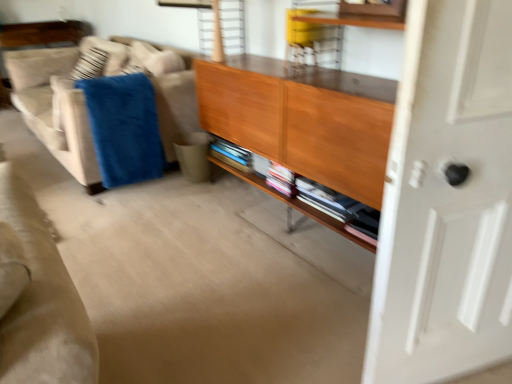
The width and height of the screenshot is (512, 384). I want to click on blue soft blanket at left, so click(124, 128).

This screenshot has height=384, width=512. What do you see at coordinates (294, 204) in the screenshot? I see `wooden shelf at center` at bounding box center [294, 204].

In the scene shown: In order to face beige fabric couch at left, should I rotate leftwards or rightwards?

To align with it, rotate left about 20.024°.

Image resolution: width=512 pixels, height=384 pixels. What do you see at coordinates (446, 200) in the screenshot?
I see `white glossy door at right` at bounding box center [446, 200].

Find the location of a particular element. The width and height of the screenshot is (512, 384). blue soft blanket at left is located at coordinates (124, 128).

Which of these two, beige fabric couch at left or wooden shelf at center, is smaller?

With smaller size is wooden shelf at center.

Is beige fabric couch at left far away from wooden shelf at center?

Indeed, beige fabric couch at left is not near wooden shelf at center.

Does beige fabric couch at left come behind wooden shelf at center?

Yes, beige fabric couch at left is behind wooden shelf at center.

In terms of height, does beige fabric couch at left look taller or shorter compared to wooden shelf at center?

Clearly, beige fabric couch at left is taller compared to wooden shelf at center.

How many degrees apart are the facing directions of wooden cabinet at center and wooden shelf at center?

The angular difference between wooden cabinet at center and wooden shelf at center is 2.34 degrees.

Is wooden cabinet at center not close to wooden shelf at center?

No, there isn't a large distance between wooden cabinet at center and wooden shelf at center.

From the image's perspective, between wooden cabinet at center and wooden shelf at center, which one is located above?

wooden cabinet at center, from the image's perspective.

Does wooden cabinet at center lie behind wooden shelf at center?

No, wooden cabinet at center is in front of wooden shelf at center.

Based on the photo, how different are the orientations of blue soft blanket at left and wooden cabinet at center in degrees?

The facing directions of blue soft blanket at left and wooden cabinet at center are 2.37 degrees apart.

From the image's perspective, which is below, blue soft blanket at left or wooden cabinet at center?

blue soft blanket at left appears lower in the image.

Looking at the image, does blue soft blanket at left seem bigger or smaller compared to wooden cabinet at center?

In the image, blue soft blanket at left appears to be smaller than wooden cabinet at center.

Considering the positions of point (145, 81) and point (271, 58), is point (145, 81) closer or farther from the camera than point (271, 58)?

Point (145, 81) is positioned farther from the camera compared to point (271, 58).

Considering the sizes of objects wooden shelf at center and wooden cabinet at center in the image provided, who is thinner, wooden shelf at center or wooden cabinet at center?

wooden shelf at center.

Between wooden shelf at center and wooden cabinet at center, which one appears on the left side from the viewer's perspective?

Positioned to the left is wooden shelf at center.

From a real-world perspective, between wooden shelf at center and wooden cabinet at center, who is vertically lower?

wooden shelf at center.

In order to click on studio couch below the wooden cabinet at center (from a real-world perspective) in this screenshot , I will do `click(61, 106)`.

From a real-world perspective, who is located lower, beige fabric couch at left or wooden cabinet at center?

beige fabric couch at left is physically lower.

Considering the points (87, 176) and (377, 173), which point is behind, point (87, 176) or point (377, 173)?

Point (87, 176)

Considering the sizes of objects beige fabric couch at left and wooden cabinet at center in the image provided, who is taller, beige fabric couch at left or wooden cabinet at center?

wooden cabinet at center is taller.

In the image, there is a beige fabric couch at left. Where is `door below it (from the image's perspective)`? door below it (from the image's perspective) is located at coordinates (446, 200).

Could you tell me if beige fabric couch at left is turned towards white glossy door at right?

No, beige fabric couch at left does not turn towards white glossy door at right.

Which is more to the left, beige fabric couch at left or white glossy door at right?

beige fabric couch at left is more to the left.

From a real-world perspective, is beige fabric couch at left below white glossy door at right?

Yes, from a real-world perspective, beige fabric couch at left is below white glossy door at right.

From a real-world perspective, between wooden shelf at center and blue soft blanket at left, who is vertically lower?

In real-world perspective, wooden shelf at center is lower.

Can you tell me how much wooden shelf at center and blue soft blanket at left differ in facing direction?

The angular difference between wooden shelf at center and blue soft blanket at left is 0.0293 degrees.

Does point (334, 225) appear closer or farther from the camera than point (154, 159)?

Point (334, 225) is closer to the camera than point (154, 159).

Where is `shelf below the beige fabric couch at left (from a real-world perspective)`? This screenshot has height=384, width=512. shelf below the beige fabric couch at left (from a real-world perspective) is located at coordinates tap(294, 204).

At what (x,y) coordinates should I click in order to perform the action: click on shelf located below the wooden cabinet at center (from the image's perspective). Please return your answer as a coordinate pair (x, y). Looking at the image, I should click on (294, 204).

When comparing their distances from wooden shelf at center, does wooden cabinet at center or blue soft blanket at left seem further?

Among the two, blue soft blanket at left is located further to wooden shelf at center.

When comparing their distances from wooden cabinet at center, does blue soft blanket at left or beige fabric couch at left seem further?

The object further to wooden cabinet at center is beige fabric couch at left.

When comparing their distances from blue soft blanket at left, does white glossy door at right or beige fabric couch at left seem closer?

Among the two, beige fabric couch at left is located nearer to blue soft blanket at left.

Based on their spatial positions, is white glossy door at right or wooden cabinet at center further from blue soft blanket at left?

Among the two, white glossy door at right is located further to blue soft blanket at left.

Considering their positions, is wooden cabinet at center positioned closer to white glossy door at right than beige fabric couch at left?

wooden cabinet at center lies closer to white glossy door at right than the other object.

Estimate the real-world distances between objects in this image. Which object is further from beige fabric couch at left, wooden cabinet at center or white glossy door at right?

white glossy door at right is positioned further to the anchor beige fabric couch at left.

When comparing their distances from beige fabric couch at left, does wooden cabinet at center or wooden shelf at center seem further?

wooden shelf at center lies further to beige fabric couch at left than the other object.

Based on their spatial positions, is wooden shelf at center or white glossy door at right closer to wooden cabinet at center?

wooden shelf at center lies closer to wooden cabinet at center than the other object.

The height and width of the screenshot is (384, 512). Find the location of `blanket situated between beige fabric couch at left and wooden shelf at center from left to right`. blanket situated between beige fabric couch at left and wooden shelf at center from left to right is located at coordinates (124, 128).

Where is `shelf between beige fabric couch at left and white glossy door at right in the horizontal direction`? shelf between beige fabric couch at left and white glossy door at right in the horizontal direction is located at coordinates (294, 204).

Where is `blanket located between beige fabric couch at left and white glossy door at right in the left-right direction`? The image size is (512, 384). blanket located between beige fabric couch at left and white glossy door at right in the left-right direction is located at coordinates (124, 128).

Locate an element on the screen. shelf between white glossy door at right and blue soft blanket at left in the front-back direction is located at coordinates [294, 204].